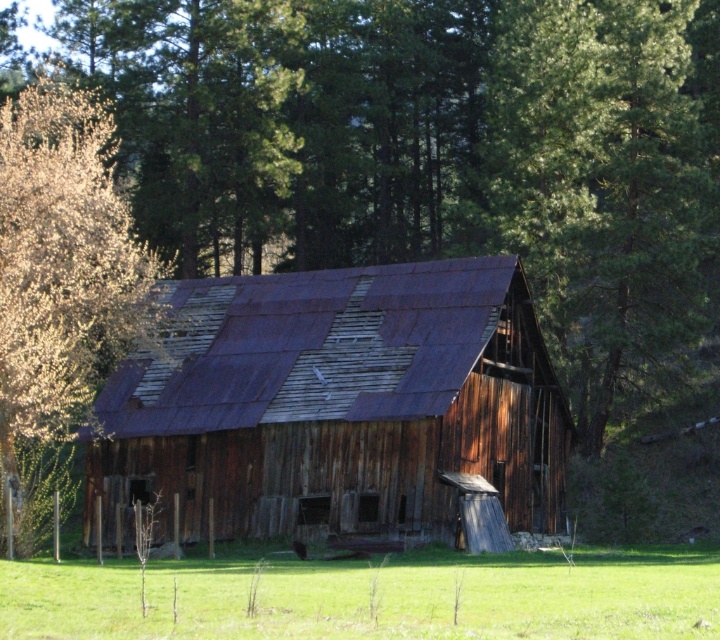
You are standing at the origin point in the image coordinate system. Where is the rusty wood barn at center located in terms of its 2D coordinates?

The rusty wood barn at center is located at the 2D coordinates of point (x=338, y=404).

Consider the image. You are standing in a field and see the rusty wood barn at center and the golden textured leaves at left. Which object appears taller from your perspective?

The golden textured leaves at left are taller than the rusty wood barn at center.

You are standing in a field and see the rusty wood barn at center in the distance. If you want to reach the barn within 10 minutes, what is the minimum speed you need to walk at?

The rusty wood barn at center is 46.45 meters away. To reach it in 10 minutes, you need to walk at a minimum speed of 0.4645 meters per second, which is approximately 0.0028 kilometers per hour. This is a very slow pace, so it is feasible.